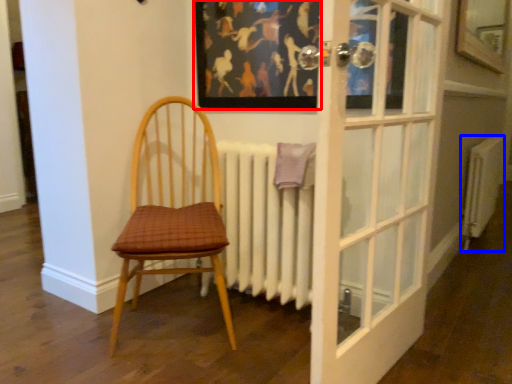
Question: Which point is further to the camera, picture frame (highlighted by a red box) or radiator (highlighted by a blue box)?

Choices:
 (A) picture frame
 (B) radiator

Answer: (B)